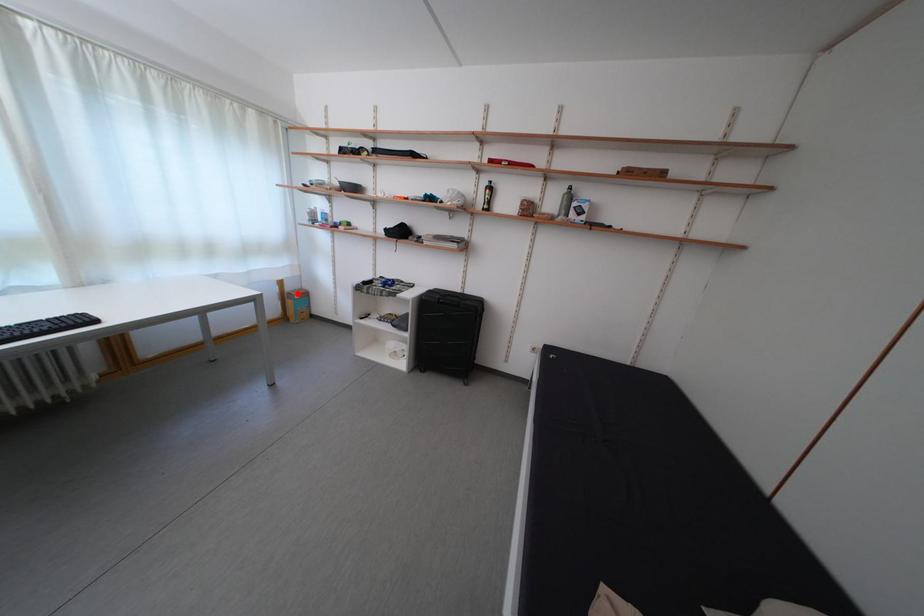
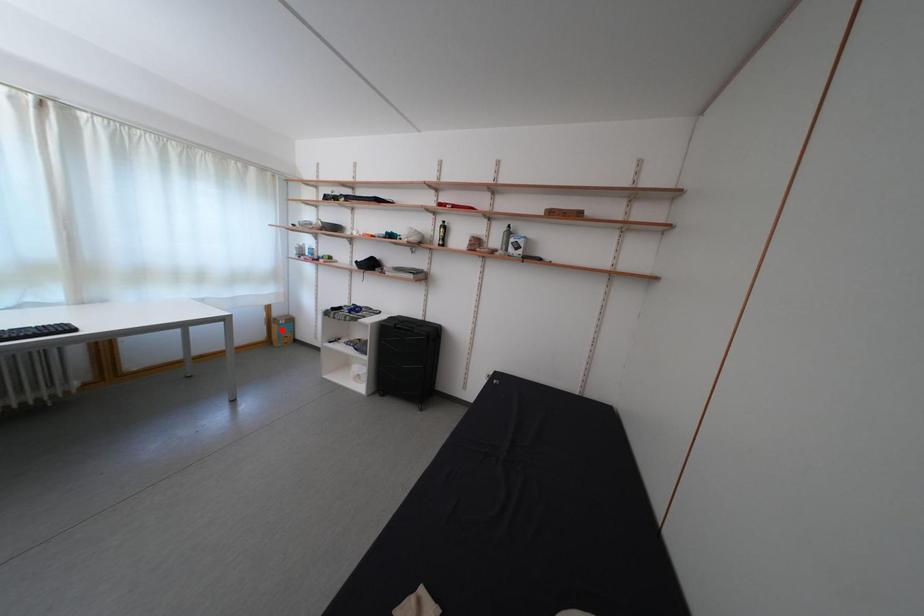
From the picture: I am providing you with two images of the same scene from different viewpoints. A red point is marked on the first image and another point is marked on the second image. Is the red point in image1 aligned with the point shown in image2?

No